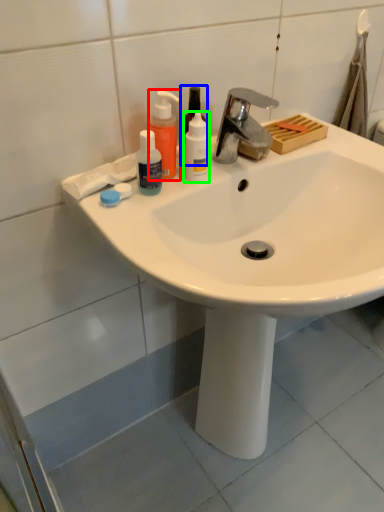
Question: Which is nearer to the cleaning product (highlighted by a red box)? mouthwash (highlighted by a blue box) or mouthwash (highlighted by a green box).

Choices:
 (A) mouthwash
 (B) mouthwash

Answer: (A)